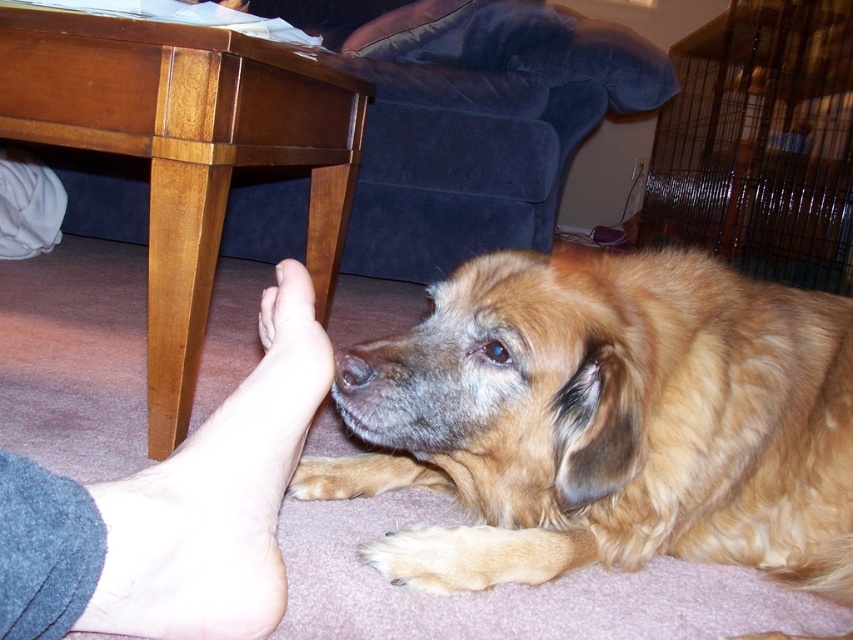
Question: Which object appears farthest from the camera in this image?

Choices:
 (A) wooden table at lower left
 (B) black wire cage at upper right
 (C) skinny flesh-toned foot at lower left
 (D) golden fur dog at lower right

Answer: (B)

Question: Which point appears closest to the camera in this image?

Choices:
 (A) (96, 516)
 (B) (480, 579)
 (C) (764, 96)
 (D) (154, 147)

Answer: (A)

Question: Is golden fur dog at lower right to the left of black wire cage at upper right from the viewer's perspective?

Choices:
 (A) no
 (B) yes

Answer: (B)

Question: Among these objects, which one is farthest from the camera?

Choices:
 (A) skinny flesh-toned foot at lower left
 (B) wooden table at lower left

Answer: (B)

Question: Does golden fur dog at lower right have a smaller size compared to black wire cage at upper right?

Choices:
 (A) yes
 (B) no

Answer: (A)

Question: Can you confirm if golden fur dog at lower right is positioned to the right of wooden table at lower left?

Choices:
 (A) yes
 (B) no

Answer: (A)